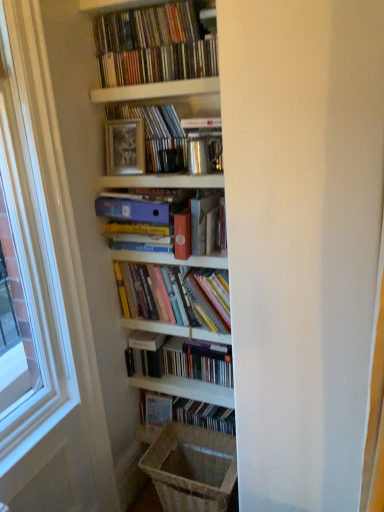
Where is `vacant space in hardcover books at center, the 2th book when ordered from bottom to top (from a real-world perspective)`? This screenshot has height=512, width=384. vacant space in hardcover books at center, the 2th book when ordered from bottom to top (from a real-world perspective) is located at coordinates (174, 378).